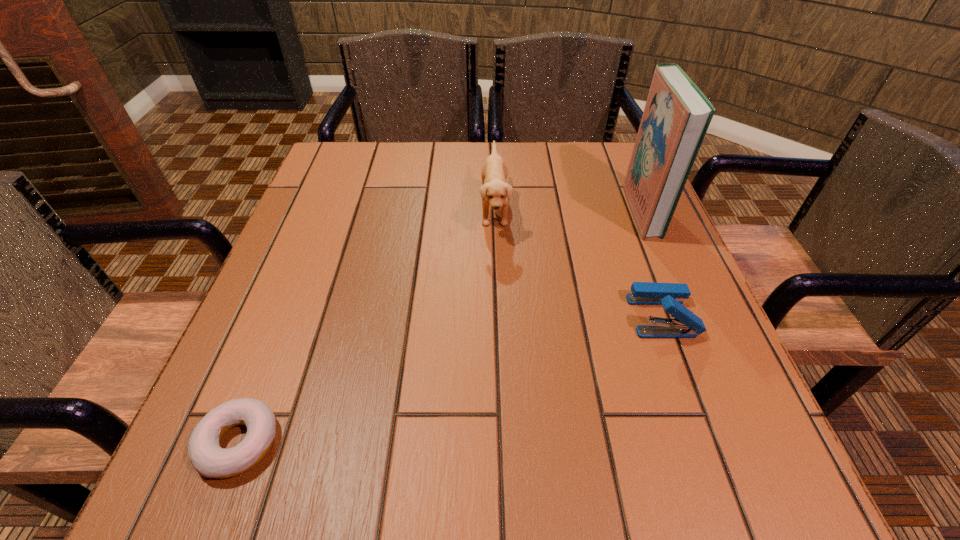
Find the location of a particular element. The width and height of the screenshot is (960, 540). vacant region located on the left side of the puppy is located at coordinates (384, 209).

Identify the location of vacant area located on the left side of the puppy. This screenshot has width=960, height=540. (346, 209).

Identify the location of vacant area situated 0.070m on the left side of the puppy. This screenshot has height=540, width=960. (449, 209).

The image size is (960, 540). I want to click on free space located on the back of the second shortest object, so click(x=615, y=188).

You are a GUI agent. You are given a task and a screenshot of the screen. Output one action in this format:
    pyautogui.click(x=<x>, y=<y>)
    Task: Click on the vacant position located on the back of the leftmost object
    The width and height of the screenshot is (960, 540).
    Given the screenshot: What is the action you would take?
    pyautogui.click(x=272, y=357)

Identify the location of hardback book at the far edge. (676, 117).

Locate an element on the screen. Image resolution: width=960 pixels, height=540 pixels. puppy at the far edge is located at coordinates [x=494, y=191].

This screenshot has height=540, width=960. What are the coordinates of `object situated at the near edge` in the screenshot? It's located at (207, 457).

The image size is (960, 540). Find the location of `object at the left edge`. object at the left edge is located at coordinates (207, 457).

This screenshot has height=540, width=960. Identify the location of hardback book that is positioned at the right edge. (676, 117).